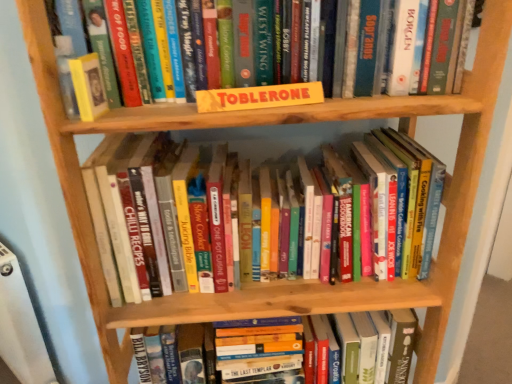
Question: From the image's perspective, is hardcover book at center, which appears as the 1th book when ordered from the bottom, positioned above or below yellow cardboard toblerone at center, acting as the second paperback book starting from the left?

Choices:
 (A) above
 (B) below

Answer: (B)

Question: From a real-world perspective, relative to yellow cardboard toblerone at center, acting as the second paperback book starting from the left, is hardcover book at center, which appears as the 1th book when ordered from the bottom, vertically above or below?

Choices:
 (A) below
 (B) above

Answer: (A)

Question: Estimate the real-world distances between objects in this image. Which object is farther from the yellow cardboard sign at upper center, which appears as the 1th book when viewed from the top?

Choices:
 (A) hardcover book at upper left, positioned as the first paperback book in left-to-right order
 (B) hardcover books at center, which is counted as the 2th book, starting from the top
 (C) hardcover book at center, acting as the third book starting from the top
 (D) yellow cardboard toblerone at center, the first paperback book when ordered from right to left

Answer: (C)

Question: Which is nearer to the hardcover books at center, which is the second book from bottom to top?

Choices:
 (A) hardcover book at center, acting as the third book starting from the top
 (B) hardcover book at upper left, positioned as the first paperback book in left-to-right order
 (C) yellow cardboard toblerone at center, acting as the second paperback book starting from the left
 (D) yellow cardboard sign at upper center, which ranks as the third book in bottom-to-top order

Answer: (D)